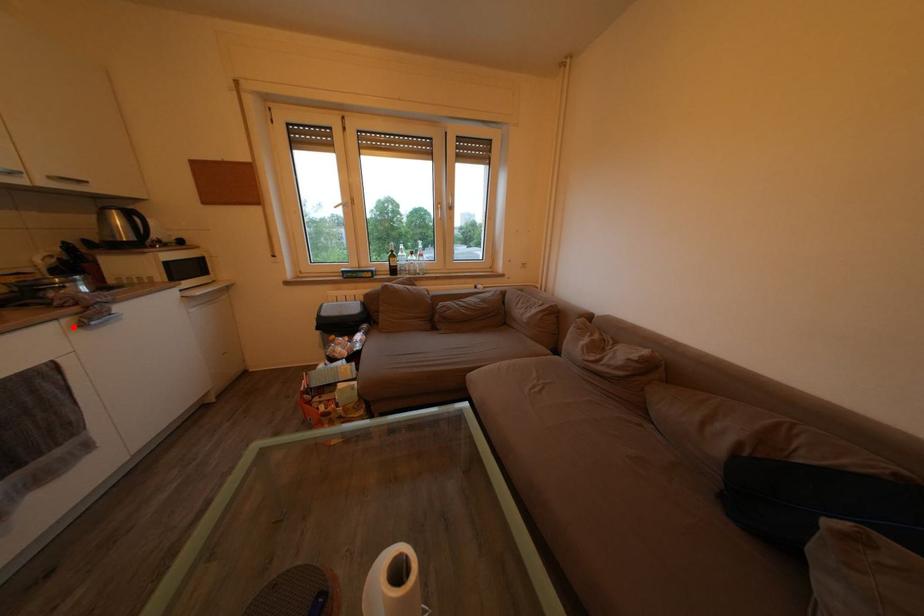
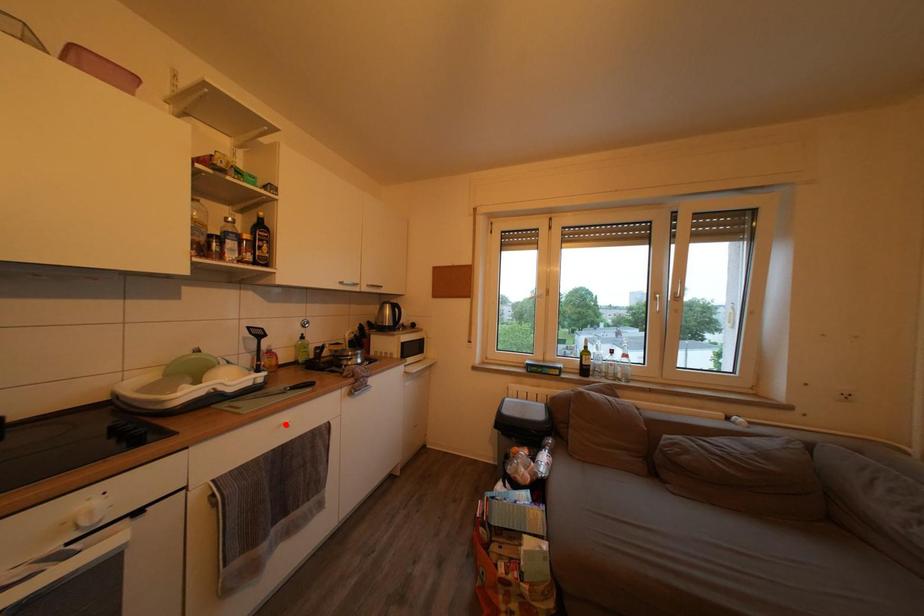
I am providing you with two images of the same scene from different viewpoints. A red point is marked on the first image and another point is marked on the second image. Does the point marked in image1 correspond to the same location as the one in image2?

No